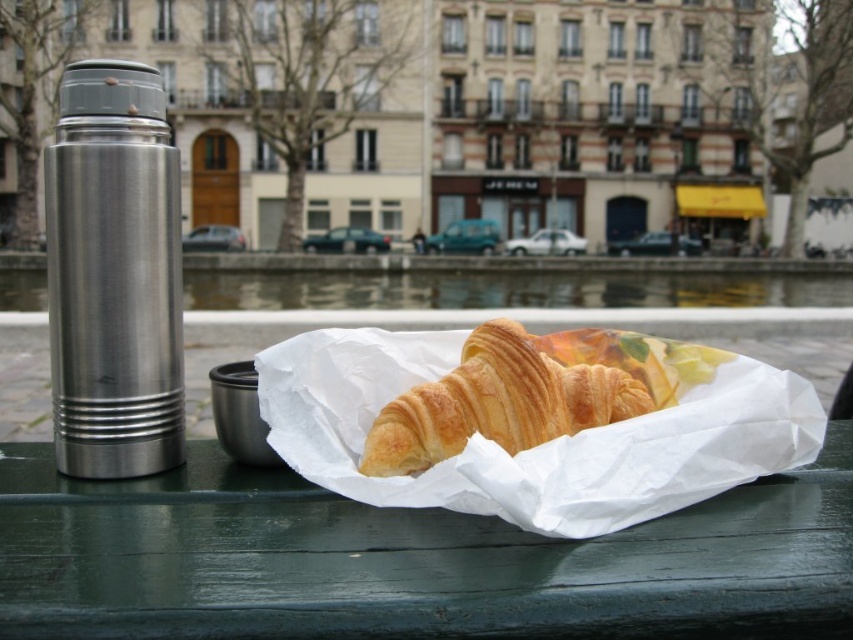
Measure the distance between green painted wood table at center and golden brown croissant at center.

green painted wood table at center is 4.10 inches from golden brown croissant at center.

Looking at this image, is green painted wood table at center behind golden brown croissant at center?

No, green painted wood table at center is closer to the viewer.

Between point (277, 576) and point (544, 369), which one is positioned in front?

Positioned in front is point (277, 576).

Where is `green painted wood table at center`? The image size is (853, 640). green painted wood table at center is located at coordinates (407, 561).